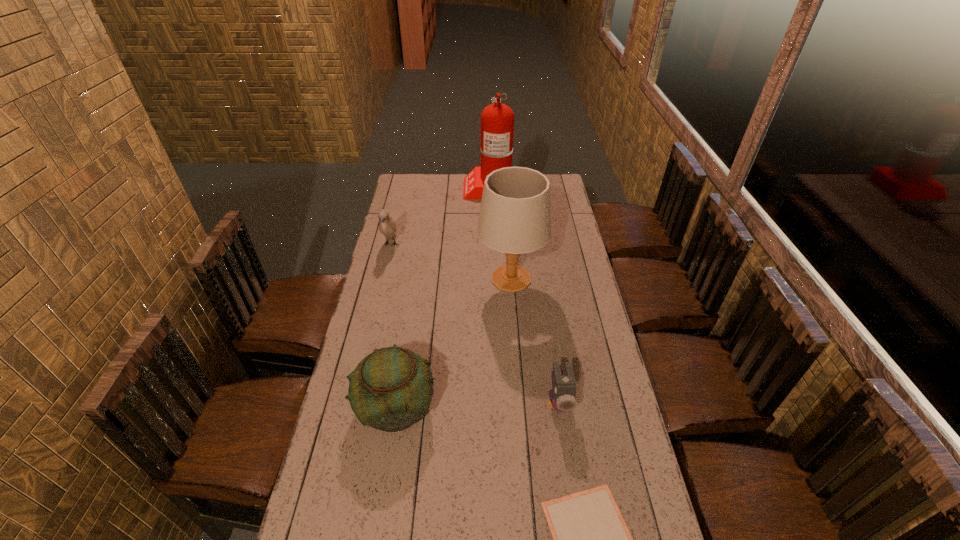
I want to click on empty space that is in between the fire extinguisher and the nearer bird, so click(524, 294).

This screenshot has width=960, height=540. In order to click on free area in between the right bird and the table lamp in this screenshot , I will do `click(535, 341)`.

The image size is (960, 540). Identify the location of unoccupied position between the shorter bird and the farthest object. (524, 294).

This screenshot has height=540, width=960. What are the coordinates of `vacant space in between the right bird and the pottery` in the screenshot? It's located at (478, 404).

This screenshot has width=960, height=540. I want to click on object that ranks as the closest to the fifth tallest object, so click(591, 539).

Select which object appears as the fifth closest to the pottery. Please provide its 2D coordinates. Your answer should be formatted as a tuple, i.e. [(x, y)], where the tuple contains the x and y coordinates of a point satisfying the conditions above.

[(497, 120)]

This screenshot has height=540, width=960. Identify the location of free space that satisfies the following two spatial constraints: 1. on the front-facing side of the table lamp; 2. on the left side of the farthest object. (492, 279).

Where is `free space that satisfies the following two spatial constraints: 1. at the beak of the farther bird; 2. on the left side of the pottery`? Image resolution: width=960 pixels, height=540 pixels. free space that satisfies the following two spatial constraints: 1. at the beak of the farther bird; 2. on the left side of the pottery is located at coordinates (351, 406).

Where is `free location that satisfies the following two spatial constraints: 1. at the beak of the farther bird; 2. on the left side of the second tallest object`? This screenshot has width=960, height=540. free location that satisfies the following two spatial constraints: 1. at the beak of the farther bird; 2. on the left side of the second tallest object is located at coordinates (382, 279).

Identify the location of vacant region that satisfies the following two spatial constraints: 1. on the front-facing side of the fire extinguisher; 2. on the left side of the second tallest object. (492, 279).